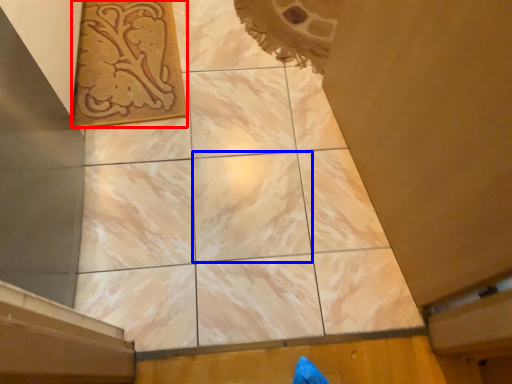
Question: Which point is closer to the camera, design (highlighted by a red box) or tile (highlighted by a blue box)?

Choices:
 (A) design
 (B) tile

Answer: (B)